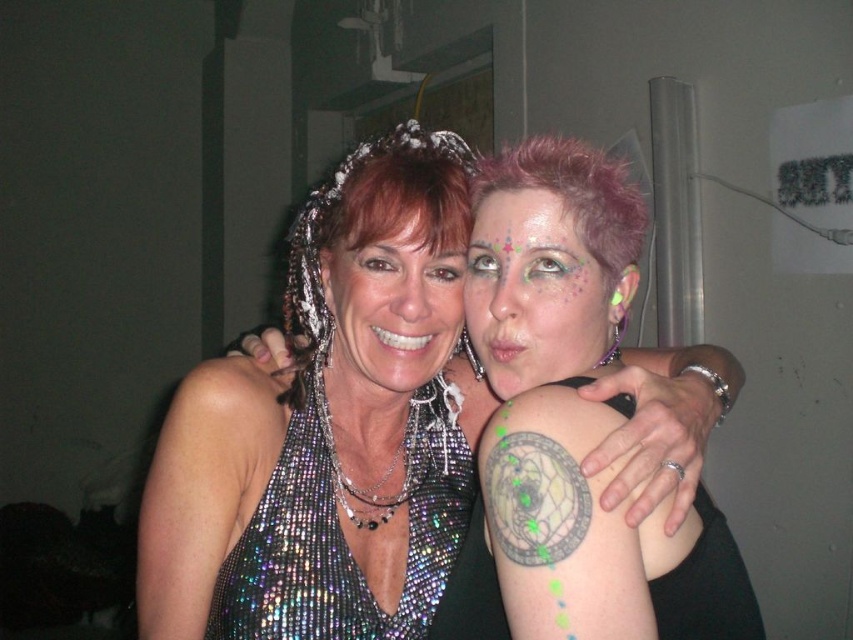
Question: Which point appears closest to the camera in this image?

Choices:
 (A) (225, 474)
 (B) (552, 413)
 (C) (378, 244)
 (D) (606, 202)

Answer: (B)

Question: Which point appears closest to the camera in this image?

Choices:
 (A) (206, 518)
 (B) (544, 499)
 (C) (567, 196)

Answer: (B)

Question: Is sparkly silver dress at center to the right of gray ink tattoo at shoulder from the viewer's perspective?

Choices:
 (A) yes
 (B) no

Answer: (A)

Question: Is sparkly silver dress at center behind shiny sequined dress at center?

Choices:
 (A) yes
 (B) no

Answer: (B)

Question: Which point is farther to the camera?

Choices:
 (A) gray ink tattoo at shoulder
 (B) sparkly silver dress at center
 (C) glittery face paint at center

Answer: (C)

Question: In this image, where is shiny metallic arm at center located relative to glittery face paint at center?

Choices:
 (A) below
 (B) above

Answer: (A)